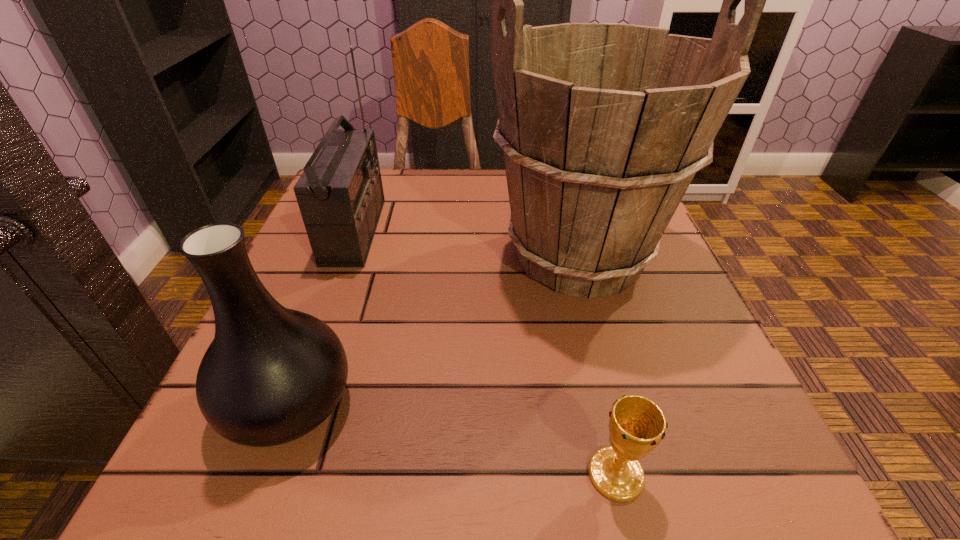
Where is `vacant space that satisfies the following two spatial constraints: 1. on the front panel of the radio receiver; 2. on the right side of the shortest object`? The height and width of the screenshot is (540, 960). vacant space that satisfies the following two spatial constraints: 1. on the front panel of the radio receiver; 2. on the right side of the shortest object is located at coordinates (266, 474).